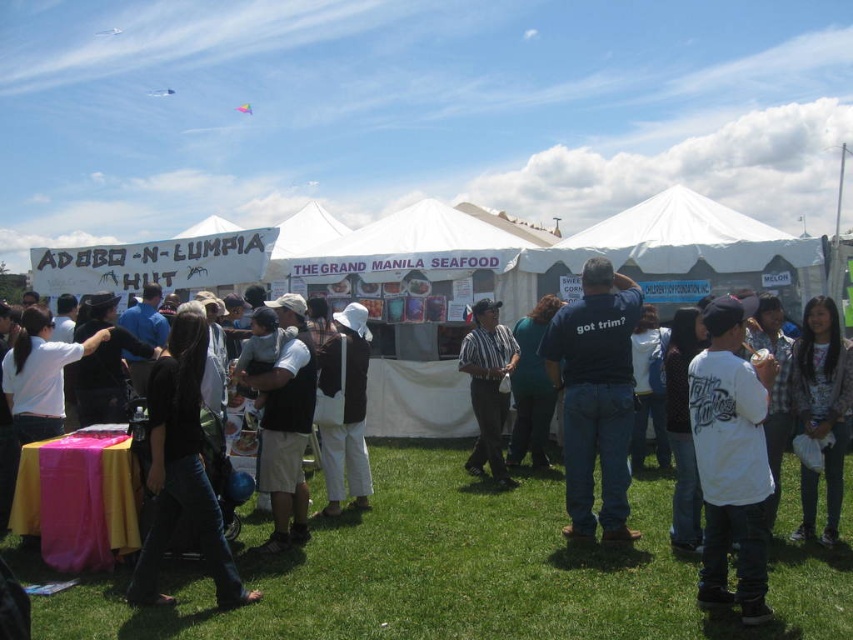
Is green grass at lower center further to camera compared to black fabric vest at center?

No, it is not.

Who is more forward, (x=463, y=480) or (x=312, y=355)?

Point (x=312, y=355) is in front.

Identify the location of green grass at lower center. (469, 573).

Which is more to the right, black cotton shirt at center or black fabric vest at center?

black fabric vest at center

Which is behind, point (136, 564) or point (289, 349)?

The point (289, 349) is behind.

Where is `black cotton shirt at center`? This screenshot has width=853, height=640. black cotton shirt at center is located at coordinates (181, 468).

Who is positioned more to the right, black fabric vest at center or white cotton hat at center?

A: white cotton hat at center is more to the right.

Which is in front, point (296, 312) or point (341, 358)?

Point (296, 312) is in front.

Is point (281, 492) more distant than point (358, 416)?

No.

The width and height of the screenshot is (853, 640). I want to click on black fabric vest at center, so click(283, 422).